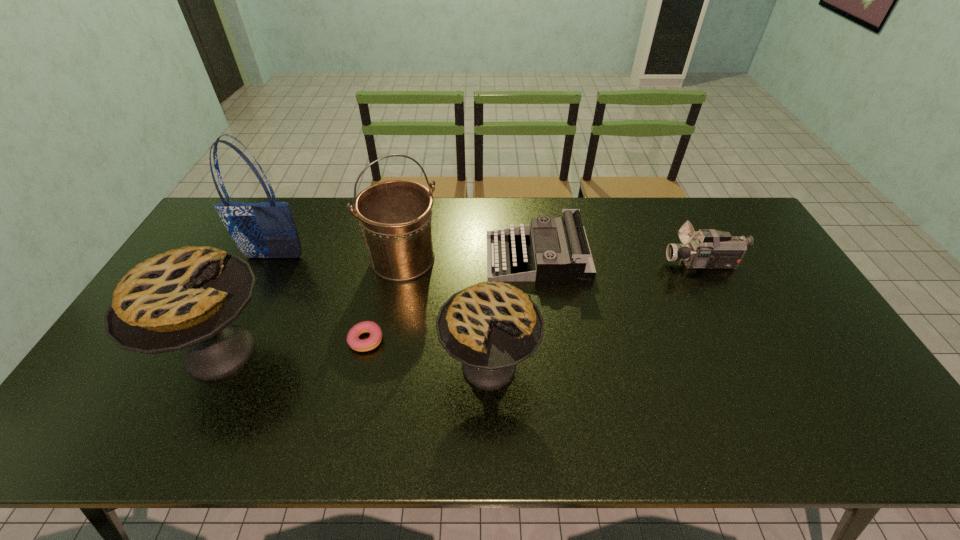
Please point out where to position a new pie on the right to maintain spacing. Please provide its 2D coordinates. Your answer should be formatted as a tuple, i.e. [(x, y)], where the tuple contains the x and y coordinates of a point satisfying the conditions above.

[(772, 380)]